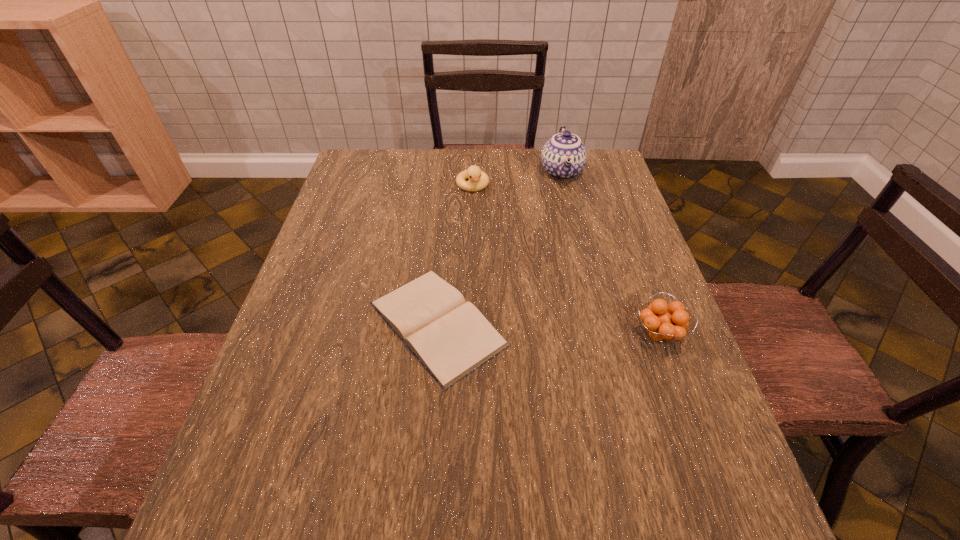
Where is `the shortest object`? The image size is (960, 540). the shortest object is located at coordinates (450, 337).

Find the location of a particular element. orange fruit is located at coordinates (661, 326).

Where is `duckling`? The height and width of the screenshot is (540, 960). duckling is located at coordinates click(x=478, y=180).

The height and width of the screenshot is (540, 960). I want to click on the tallest object, so click(563, 157).

Image resolution: width=960 pixels, height=540 pixels. I want to click on blank space located on the left of the Bible, so pos(317,323).

Find the location of a particular element. The height and width of the screenshot is (540, 960). vacant area located on the back of the orange fruit is located at coordinates (x=620, y=227).

Find the location of `vacant space situated 0.180m at the beak of the duckling`. vacant space situated 0.180m at the beak of the duckling is located at coordinates (487, 233).

This screenshot has width=960, height=540. I want to click on free region located 0.260m at the beak of the duckling, so click(492, 251).

Where is `free space located 0.100m at the beak of the duckling`? Image resolution: width=960 pixels, height=540 pixels. free space located 0.100m at the beak of the duckling is located at coordinates (481, 215).

Locate an element on the screen. vacant space positioned 0.210m from the spout of the tallest object is located at coordinates (568, 236).